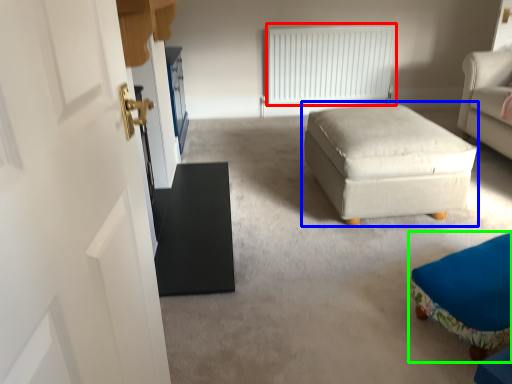
Question: Which object is the farthest from radiator (highlighted by a red box)? Choose among these: table (highlighted by a blue box) or furniture (highlighted by a green box).

Choices:
 (A) table
 (B) furniture

Answer: (B)